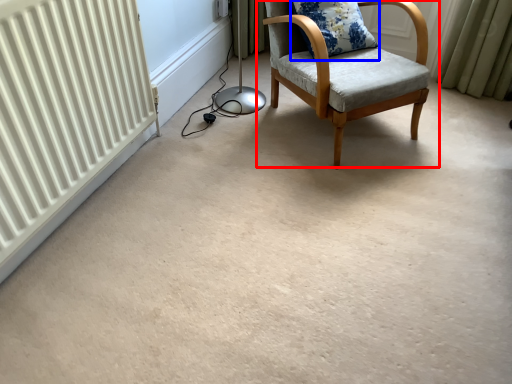
Question: Which object appears farthest to the camera in this image, chair (highlighted by a red box) or pillow (highlighted by a blue box)?

Choices:
 (A) chair
 (B) pillow

Answer: (B)